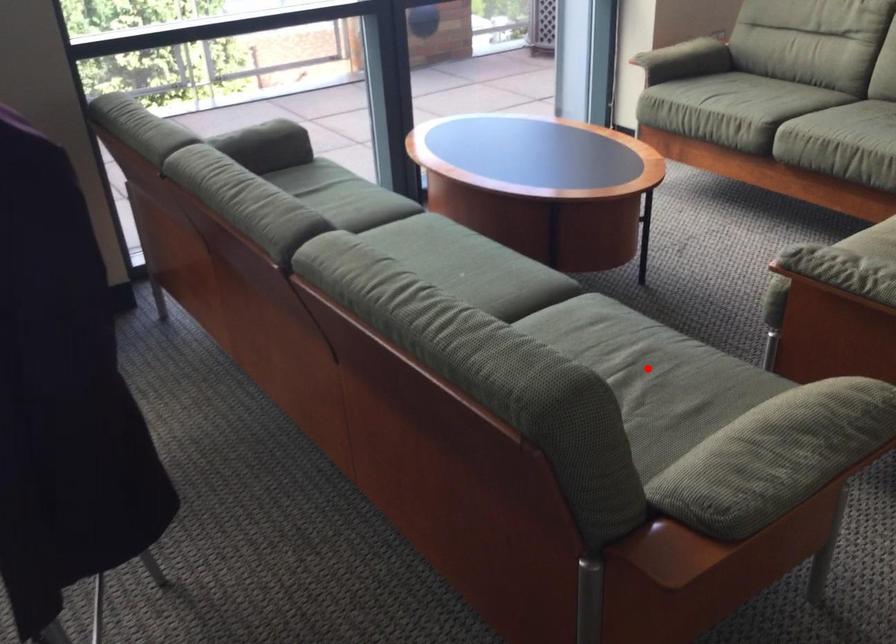
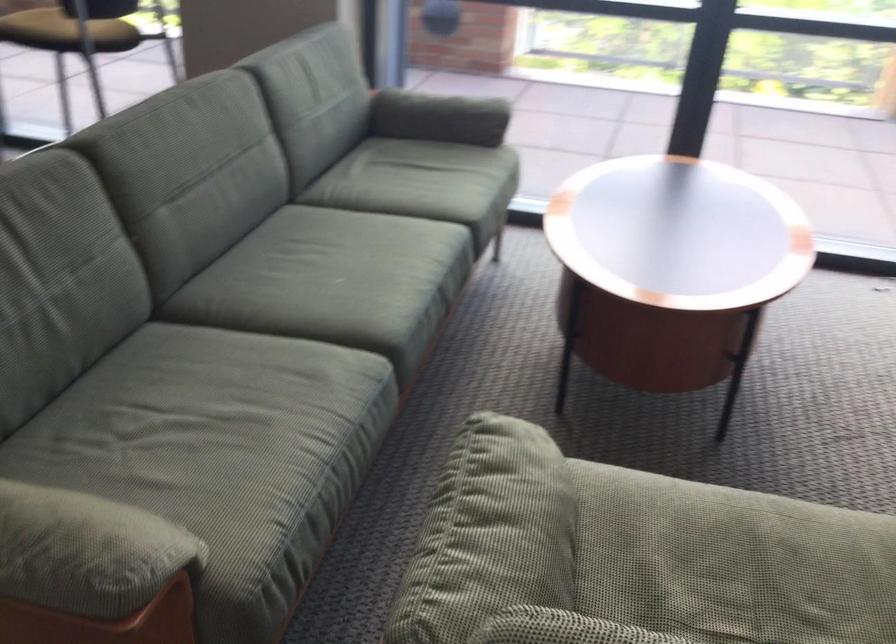
Question: A red point is marked in image1. In image2, is the corresponding 3D point closer to the camera or farther? Reply with the corresponding letter.

Choices:
 (A) The corresponding 3D point is closer.
 (B) The corresponding 3D point is farther.

Answer: (A)